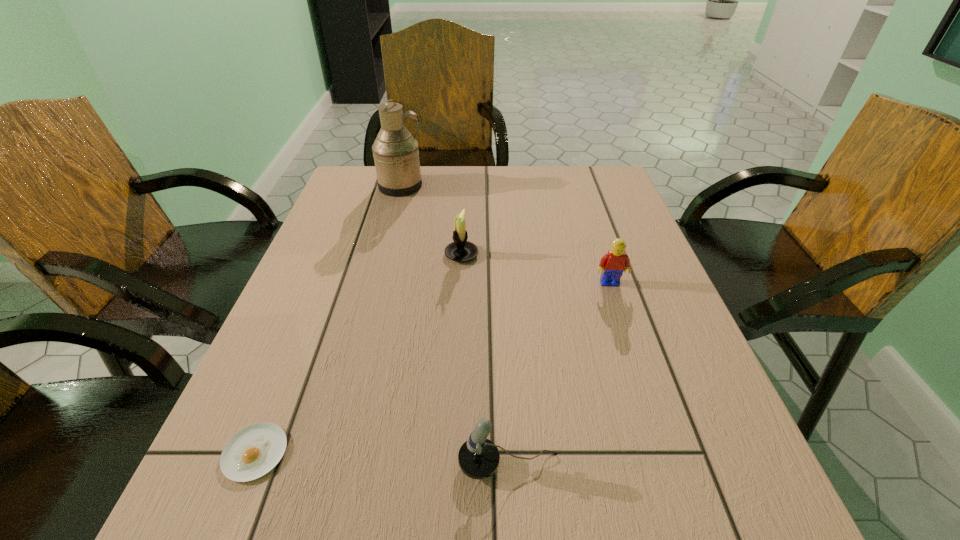
At what (x,y) coordinates should I click in order to perform the action: click on free region at the right edge of the desktop. Please return your answer as a coordinate pair (x, y). Looking at the image, I should click on (639, 332).

Locate an element on the screen. blank area at the far left corner is located at coordinates (360, 187).

At what (x,y) coordinates should I click in order to perform the action: click on free space at the near left corner. Please return your answer as a coordinate pair (x, y). Image resolution: width=960 pixels, height=540 pixels. Looking at the image, I should click on (237, 524).

In the image, there is a desktop. At what (x,y) coordinates should I click in order to perform the action: click on free region at the far right corner. Please return your answer as a coordinate pair (x, y). Image resolution: width=960 pixels, height=540 pixels. Looking at the image, I should click on (591, 167).

Image resolution: width=960 pixels, height=540 pixels. Identify the location of unoccupied position between the farthest object and the egg yolk. (328, 319).

Where is `vacant space that's between the microphone and the egg yolk`? The image size is (960, 540). vacant space that's between the microphone and the egg yolk is located at coordinates (382, 458).

The height and width of the screenshot is (540, 960). In order to click on vacant area that lies between the tallest object and the microphone in this screenshot , I will do `click(455, 325)`.

Find the location of a particular element. The width and height of the screenshot is (960, 540). unoccupied area between the third farthest object and the egg yolk is located at coordinates (432, 368).

Where is `vacant point located between the farthest object and the candle holder`? The image size is (960, 540). vacant point located between the farthest object and the candle holder is located at coordinates (431, 220).

The image size is (960, 540). Identify the location of free space between the shortest object and the second farthest object. (358, 354).